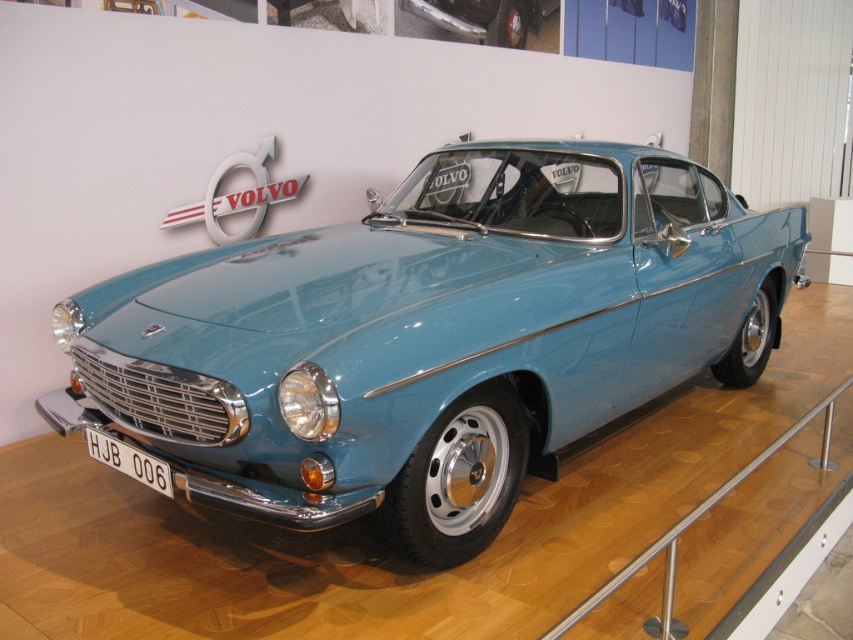
Can you confirm if light blue metallic car at center is positioned to the left of metallic blue car at center?

In fact, light blue metallic car at center is to the right of metallic blue car at center.

Is light blue metallic car at center to the right of metallic blue car at center from the viewer's perspective?

Indeed, light blue metallic car at center is positioned on the right side of metallic blue car at center.

Does point (618, 195) come behind point (436, 4)?

No, (618, 195) is in front of (436, 4).

Where is `light blue metallic car at center`? The width and height of the screenshot is (853, 640). light blue metallic car at center is located at coordinates (432, 337).

Between metallic blue car at center and white plastic license plate at front, which one has less height?

white plastic license plate at front is shorter.

Measure the distance between metallic blue car at center and white plastic license plate at front.

A distance of 4.62 meters exists between metallic blue car at center and white plastic license plate at front.

Where is `metallic blue car at center`? metallic blue car at center is located at coordinates (485, 17).

Can you confirm if silver/metallic rail at lower right is positioned to the left of metallic blue car at center?

In fact, silver/metallic rail at lower right is to the right of metallic blue car at center.

Does silver/metallic rail at lower right have a greater height compared to metallic blue car at center?

Correct, silver/metallic rail at lower right is much taller as metallic blue car at center.

Which is behind, point (669, 531) or point (467, 35)?

The point (467, 35) is more distant.

The image size is (853, 640). I want to click on silver/metallic rail at lower right, so click(x=695, y=520).